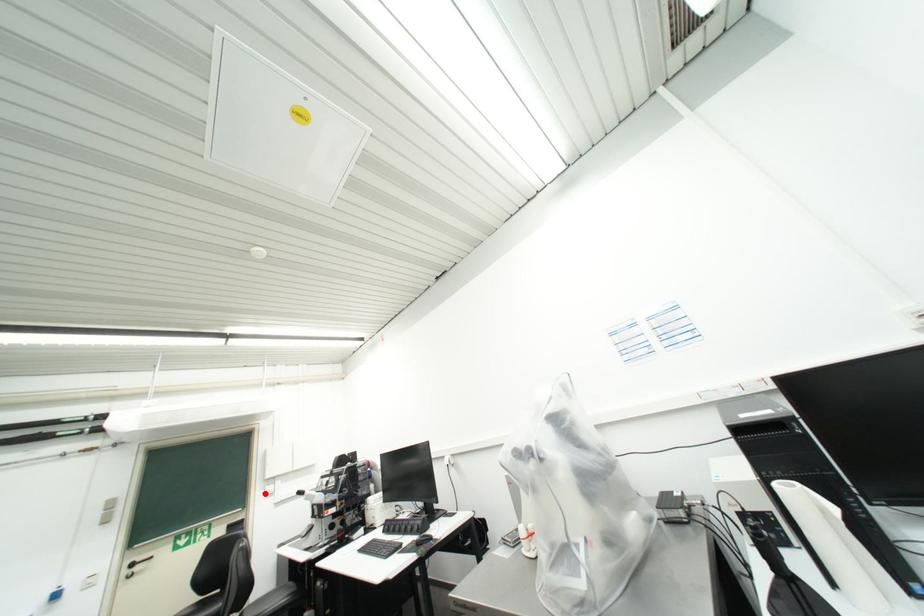
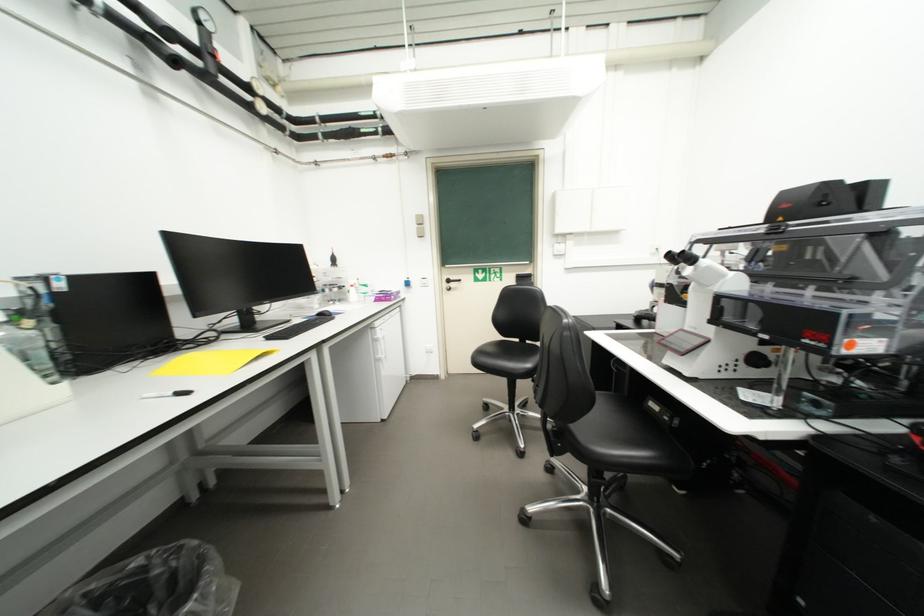
Where in the second image is the point corresponding to the highlighted location from the first image?

(553, 249)